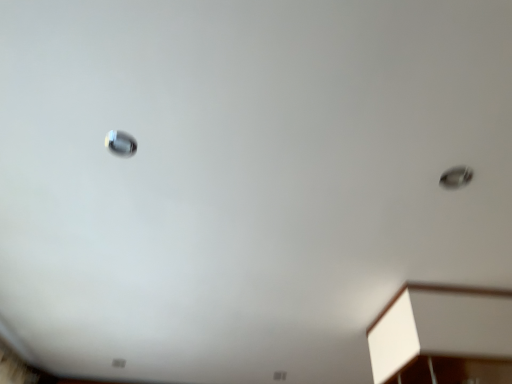
Question: Considering the positions of satin silver droplight at upper left, which ranks as the first droplight in top-to-bottom order, and white matte cabinet at lower right in the image, is satin silver droplight at upper left, which ranks as the first droplight in top-to-bottom order, wider or thinner than white matte cabinet at lower right?

Choices:
 (A) thin
 (B) wide

Answer: (A)

Question: Considering the relative positions of satin silver droplight at upper left, positioned as the first droplight in front-to-back order, and white matte cabinet at lower right in the image provided, is satin silver droplight at upper left, positioned as the first droplight in front-to-back order, to the left or to the right of white matte cabinet at lower right?

Choices:
 (A) right
 (B) left

Answer: (B)

Question: Based on their relative distances, which object is farther from the satin silver droplight at upper left, positioned as the 2th droplight in right-to-left order?

Choices:
 (A) white matte cabinet at lower right
 (B) metallic silver droplight at upper right, acting as the first droplight starting from the bottom

Answer: (A)

Question: Considering the real-world distances, which object is closest to the metallic silver droplight at upper right, acting as the first droplight starting from the bottom?

Choices:
 (A) white matte cabinet at lower right
 (B) satin silver droplight at upper left, marked as the first droplight in a left-to-right arrangement

Answer: (A)